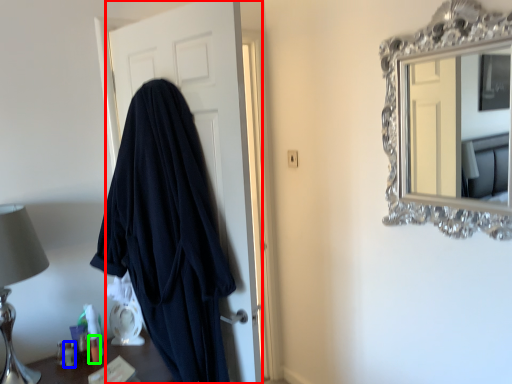
Question: Which object is the farthest from door (highlighted by a red box)? Choose among these: toiletry (highlighted by a blue box) or toiletry (highlighted by a green box).

Choices:
 (A) toiletry
 (B) toiletry

Answer: (A)